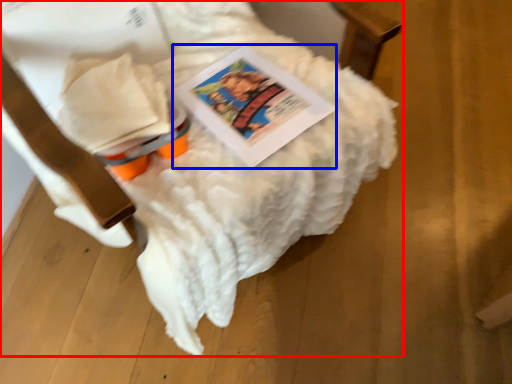
Question: Which object is closer to the camera taking this photo, furniture (highlighted by a red box) or book (highlighted by a blue box)?

Choices:
 (A) furniture
 (B) book

Answer: (A)